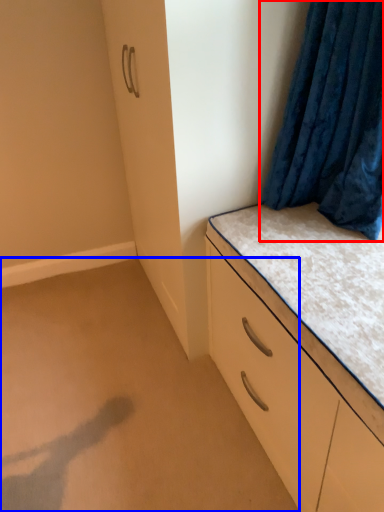
Question: Which object appears closest to the camera in this image, curtain (highlighted by a red box) or plain (highlighted by a blue box)?

Choices:
 (A) curtain
 (B) plain

Answer: (A)